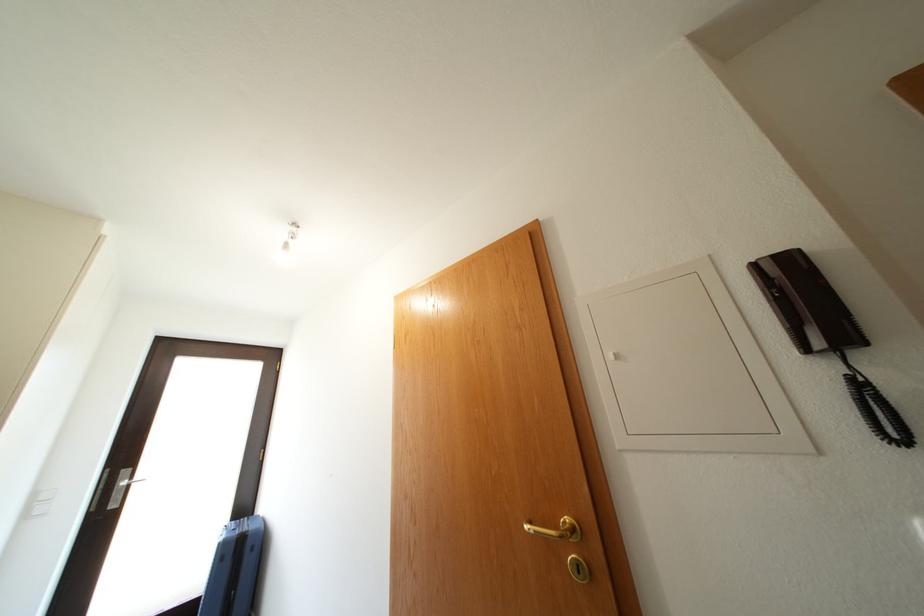
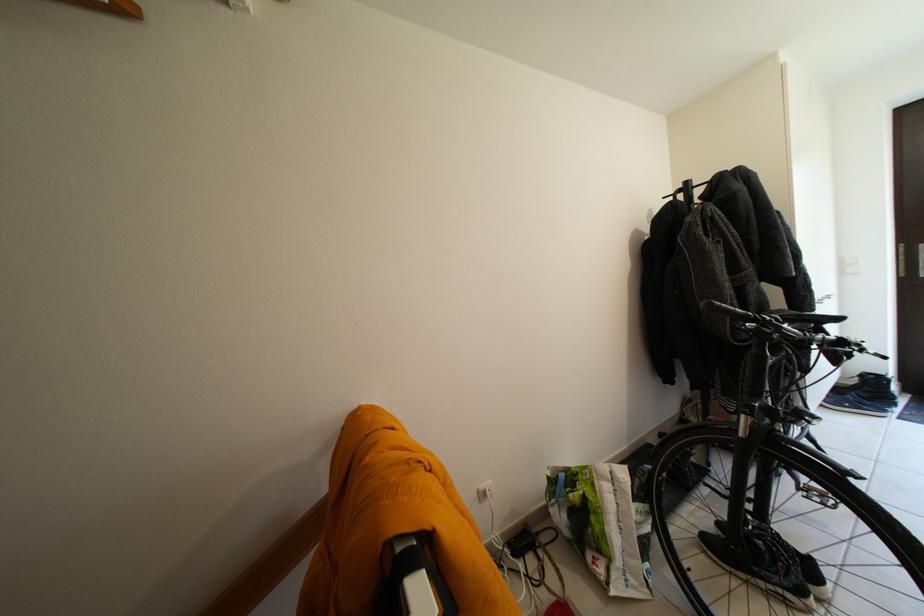
Question: The camera is either moving clockwise (left) or counter-clockwise (right) around the object. The first image is from the beginning of the video and the second image is from the end. Is the camera moving left or right when shooting the video?

Choices:
 (A) Left
 (B) Right

Answer: (B)